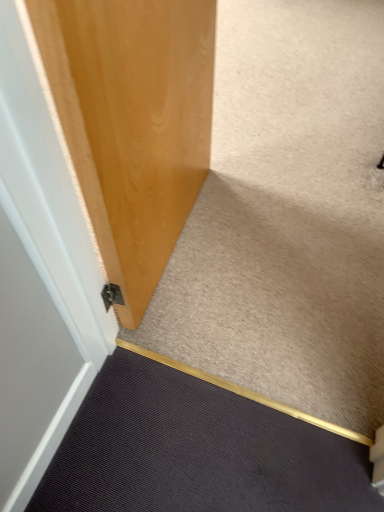
The width and height of the screenshot is (384, 512). Find the location of `dark gray textured mat at lower left`. dark gray textured mat at lower left is located at coordinates (x=196, y=451).

Image resolution: width=384 pixels, height=512 pixels. What do you see at coordinates (196, 451) in the screenshot?
I see `dark gray textured mat at lower left` at bounding box center [196, 451].

Where is `dark gray textured mat at lower left`? The image size is (384, 512). dark gray textured mat at lower left is located at coordinates [x=196, y=451].